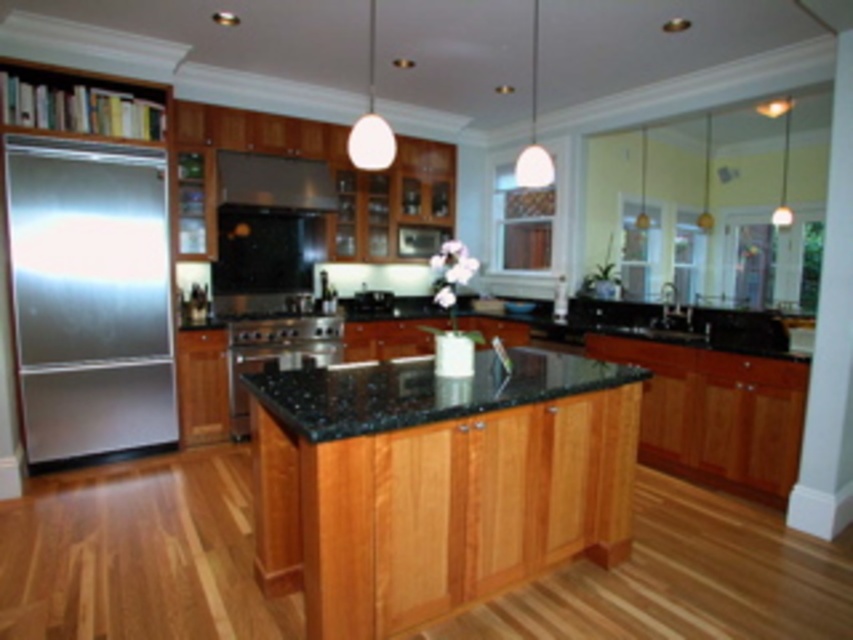
Question: Is natural wood island at center to the right of stainless steel refrigerator at left from the viewer's perspective?

Choices:
 (A) yes
 (B) no

Answer: (A)

Question: Which object is positioned closest to the black granite sink at center?

Choices:
 (A) satin black exhaust hood at upper center
 (B) natural wood island at center
 (C) black granite countertop at center
 (D) stainless steel refrigerator at left

Answer: (C)

Question: Is natural wood island at center wider than satin black exhaust hood at upper center?

Choices:
 (A) yes
 (B) no

Answer: (A)

Question: Which point appears farthest from the camera in this image?

Choices:
 (A) (558, 368)
 (B) (701, 333)
 (C) (328, 177)

Answer: (C)

Question: Can you confirm if satin black exhaust hood at upper center is positioned below black granite sink at center?

Choices:
 (A) yes
 (B) no

Answer: (B)

Question: Estimate the real-world distances between objects in this image. Which object is closer to the black granite countertop at center?

Choices:
 (A) black granite sink at center
 (B) stainless steel refrigerator at left
 (C) natural wood island at center
 (D) satin black exhaust hood at upper center

Answer: (C)